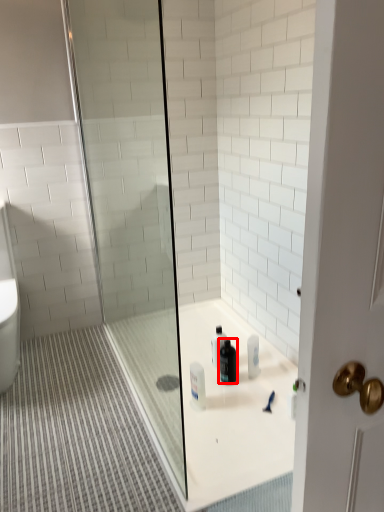
Question: From the image, what is the correct spatial relationship of cleaning product (annotated by the red box) in relation to shower door?

Choices:
 (A) left
 (B) right

Answer: (B)